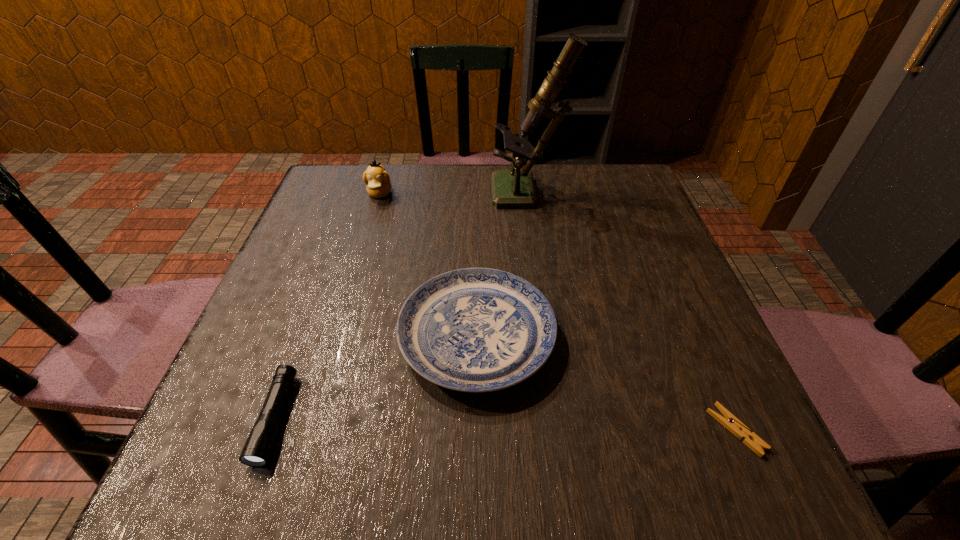
Where is `free space located 0.080m on the face of the fourth object from right to left`? This screenshot has height=540, width=960. free space located 0.080m on the face of the fourth object from right to left is located at coordinates (371, 224).

Image resolution: width=960 pixels, height=540 pixels. Identify the location of vacant space situated on the right of the plate. (708, 336).

Where is `vacant space located on the left of the shortest object`? This screenshot has width=960, height=540. vacant space located on the left of the shortest object is located at coordinates (530, 430).

Identify the location of microscope situated at the far edge. 510,188.

The image size is (960, 540). Find the location of `duckling that is at the far edge`. duckling that is at the far edge is located at coordinates (377, 179).

The image size is (960, 540). I want to click on flashlight positioned at the near edge, so click(x=257, y=449).

Find the location of a particular element. clothespin that is at the near edge is located at coordinates (729, 421).

Find the location of a particular element. This screenshot has width=960, height=540. duckling at the left edge is located at coordinates (377, 179).

The width and height of the screenshot is (960, 540). Identify the location of flashlight located in the left edge section of the desktop. pos(257,449).

This screenshot has height=540, width=960. Identify the location of object situated at the right edge. (729, 421).